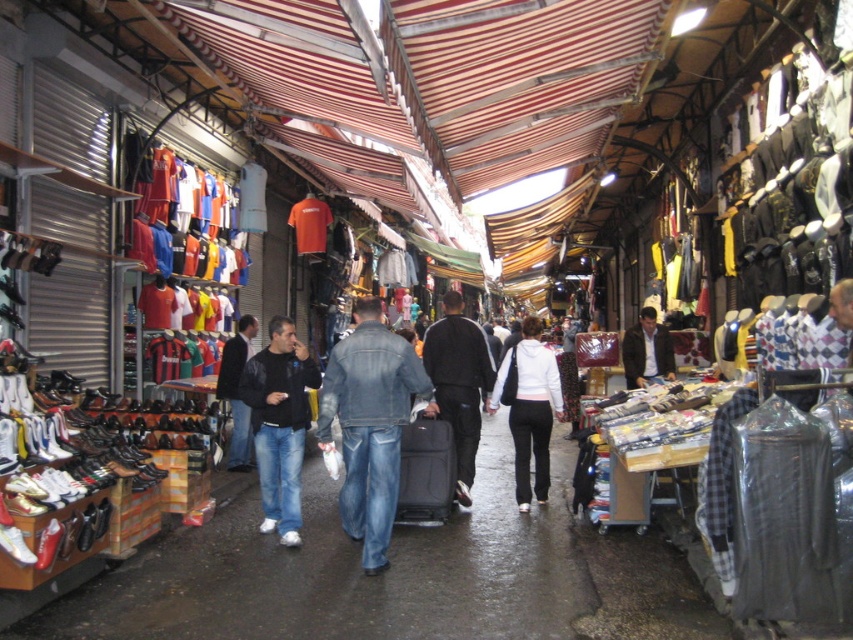
Question: In this image, where is denim jacket at center located relative to dark brown leather jacket at center?

Choices:
 (A) right
 (B) left

Answer: (B)

Question: Does denim jacket at center appear over black leather jacket at center?

Choices:
 (A) yes
 (B) no

Answer: (A)

Question: Which point is farther from the camera taking this photo?

Choices:
 (A) (520, 470)
 (B) (277, 344)
 (C) (393, 403)
 (D) (225, 461)

Answer: (D)

Question: Which of these objects is positioned closest to the dark blue jeans at center?

Choices:
 (A) dark brown leather jacket at center
 (B) denim jacket at center
 (C) dark blue leather jacket at center

Answer: (B)

Question: Can you confirm if black leather jacket at center is bigger than dark brown leather jacket at center?

Choices:
 (A) no
 (B) yes

Answer: (B)

Question: Which point is closer to the camera?

Choices:
 (A) dark brown leather jacket at center
 (B) dark blue jeans at center
 (C) denim jacket at center

Answer: (C)